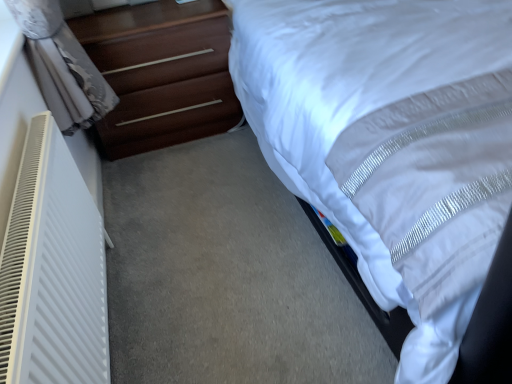
Question: Can you confirm if white plastic radiator at left is bigger than white satin bed at upper right?

Choices:
 (A) no
 (B) yes

Answer: (A)

Question: Is white plastic radiator at left not inside white satin bed at upper right?

Choices:
 (A) yes
 (B) no

Answer: (A)

Question: From a real-world perspective, is white plastic radiator at left on white satin bed at upper right?

Choices:
 (A) no
 (B) yes

Answer: (A)

Question: Can you confirm if white plastic radiator at left is wider than white satin bed at upper right?

Choices:
 (A) no
 (B) yes

Answer: (A)

Question: Can you confirm if white plastic radiator at left is thinner than white satin bed at upper right?

Choices:
 (A) yes
 (B) no

Answer: (A)

Question: Does white plastic radiator at left come behind white satin bed at upper right?

Choices:
 (A) yes
 (B) no

Answer: (A)

Question: From a real-world perspective, is white satin bed at upper right physically above white plastic radiator at left?

Choices:
 (A) no
 (B) yes

Answer: (B)

Question: Is white satin bed at upper right surrounding white plastic radiator at left?

Choices:
 (A) no
 (B) yes

Answer: (A)

Question: From the image's perspective, is white satin bed at upper right over white plastic radiator at left?

Choices:
 (A) no
 (B) yes

Answer: (B)

Question: Considering the relative sizes of white satin bed at upper right and white plastic radiator at left in the image provided, is white satin bed at upper right taller than white plastic radiator at left?

Choices:
 (A) yes
 (B) no

Answer: (A)

Question: Does white satin bed at upper right appear on the left side of white plastic radiator at left?

Choices:
 (A) yes
 (B) no

Answer: (B)

Question: Is white satin bed at upper right positioned beyond the bounds of white plastic radiator at left?

Choices:
 (A) yes
 (B) no

Answer: (A)

Question: Considering the relative sizes of dark brown wood chest of drawers at left and white satin bed at upper right in the image provided, is dark brown wood chest of drawers at left smaller than white satin bed at upper right?

Choices:
 (A) yes
 (B) no

Answer: (A)